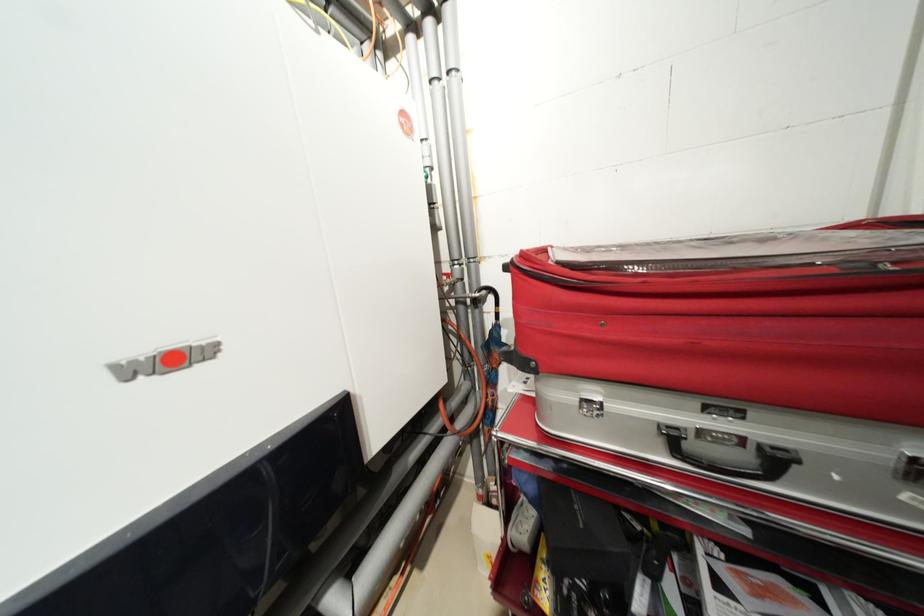
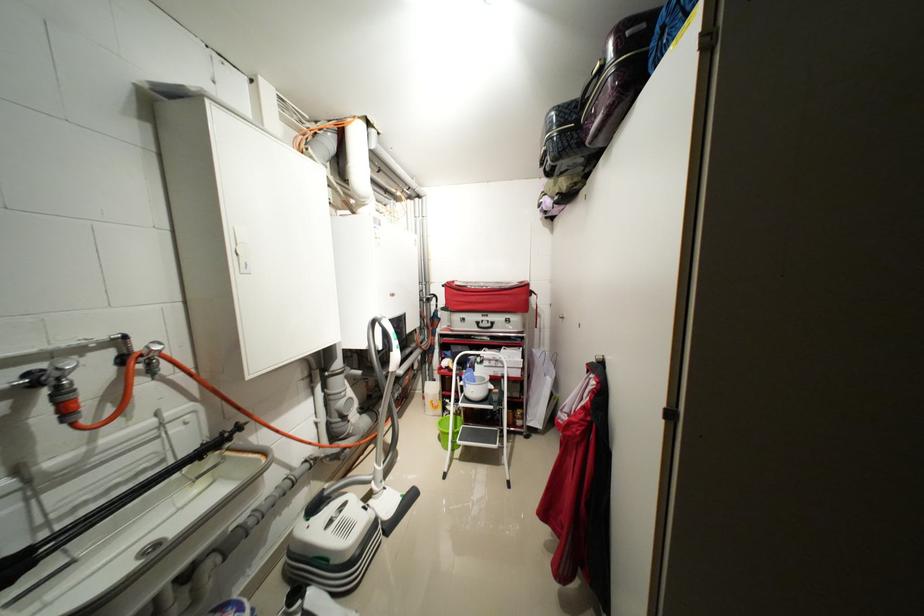
The point at (530, 256) is marked in the first image. Where is the corresponding point in the second image?

(455, 284)